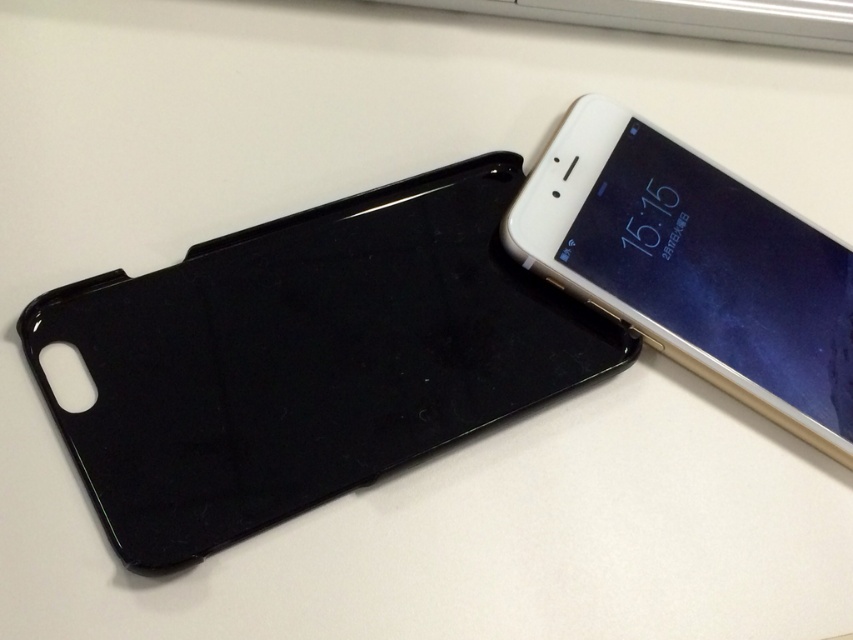
You are a delivery robot with a 10 inch wide package. You need to move the package from the black matte phone case at lower left to the white glossy smartphone at upper right. Can you fit the package through the space between them without tilting it?

The distance between the black matte phone case at lower left and the white glossy smartphone at upper right is 11.04 inches, which is wider than the 10 inch package. Therefore, the package can be moved through the space between them without tilting.